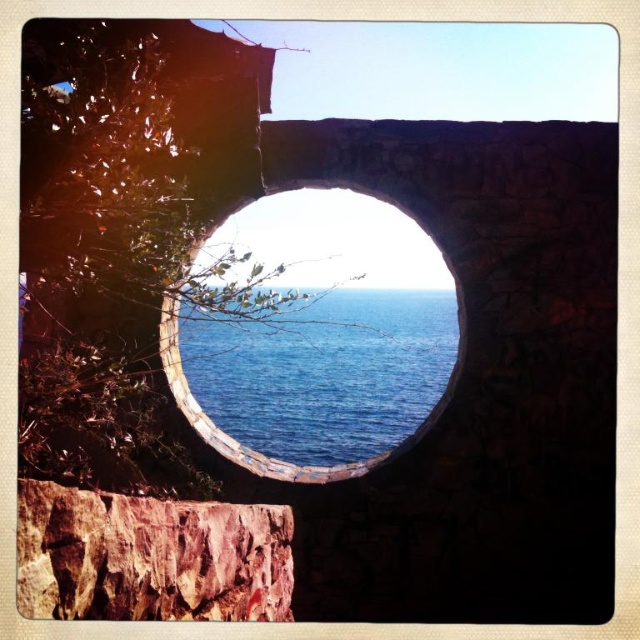
You are a bird looking for a nesting spot. You see the rustic stone cliff at center and the smooth stone hole at center. Which location would provide a higher vantage point for nesting?

The rustic stone cliff at center is above the smooth stone hole at center, so it would provide a higher vantage point for nesting.

You are an architect examining the structure of the stone wall. You notice the rustic stone cliff at center and the smooth stone hole at center. Which of these two objects is smaller in size?

The rustic stone cliff at center is smaller in size compared to the smooth stone hole at center according to the description.

You are standing in front of a stone structure with a circular opening. You notice two features at the center of the image. One is the rustic stone cliff at center and the other is the smooth stone hole at center. Which of these two features is taller?

The smooth stone hole at center is taller than the rustic stone cliff at center according to the description.